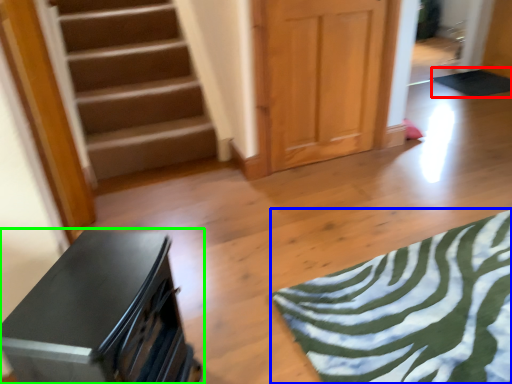
Question: Which object is positioned farthest from yoga mat (highlighted by a red box)? Select from yoga mat (highlighted by a blue box) and furniture (highlighted by a green box).

Choices:
 (A) yoga mat
 (B) furniture

Answer: (B)